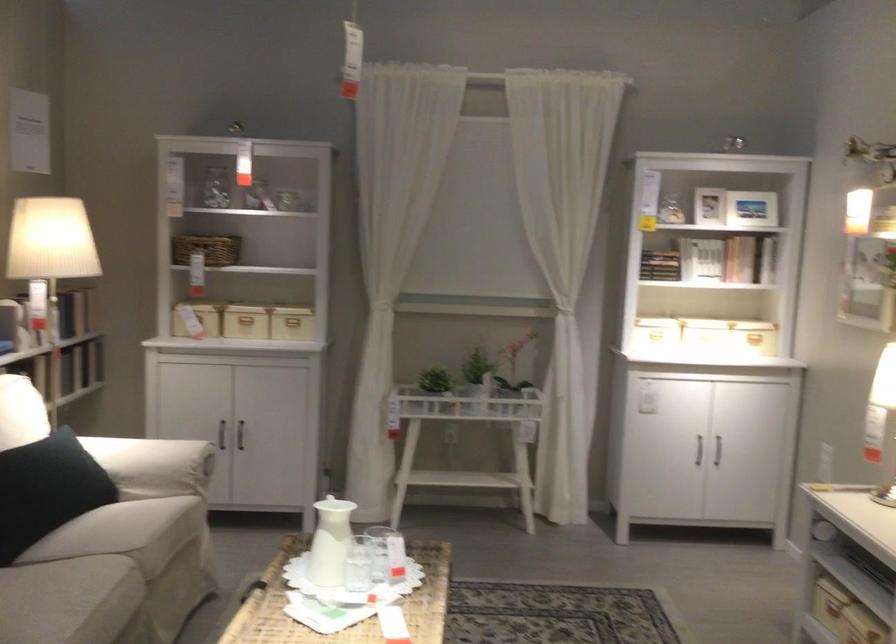
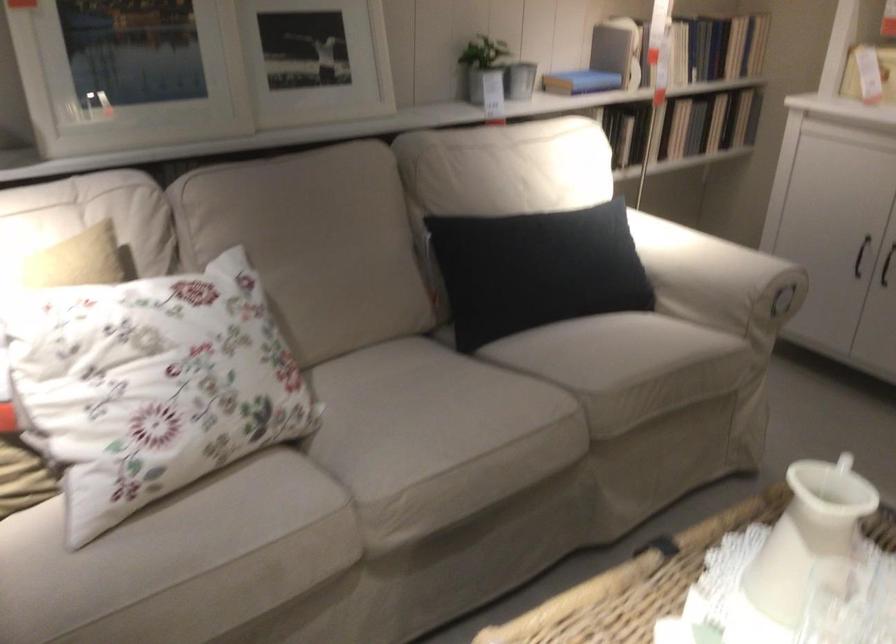
The point at (340, 551) is marked in the first image. Where is the corresponding point in the second image?

(803, 552)